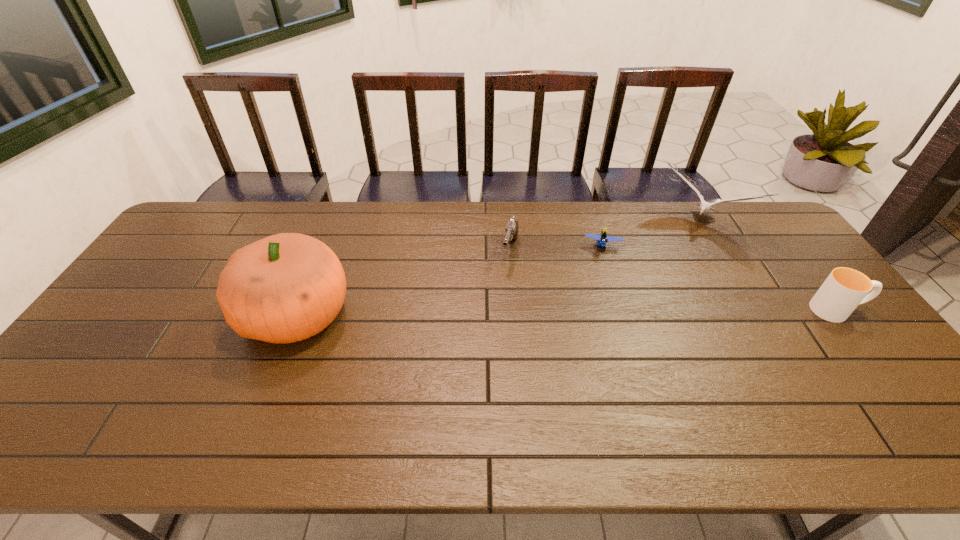
At what (x,y) coordinates should I click in order to perform the action: click on blank region between the tallest object and the second tallest object. Please return your answer as a coordinate pair (x, y). The width and height of the screenshot is (960, 540). Looking at the image, I should click on (498, 268).

I want to click on object that stands as the third closest to the pistol, so click(705, 207).

Identify which object is the second closest to the rightmost object. Please provide its 2D coordinates. Your answer should be formatted as a tuple, i.e. [(x, y)], where the tuple contains the x and y coordinates of a point satisfying the conditions above.

[(602, 238)]

Locate an element on the screen. This screenshot has height=540, width=960. free location that satisfies the following two spatial constraints: 1. on the front side of the fourth object from right to left; 2. with the handle on the side of the rightmost object is located at coordinates (515, 310).

This screenshot has height=540, width=960. In order to click on vacant space that satisfies the following two spatial constraints: 1. on the front side of the cup; 2. with the handle on the side of the gull in this screenshot , I will do `click(750, 310)`.